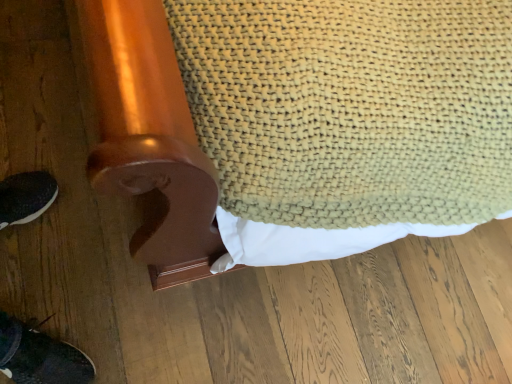
What do you see at coordinates (302, 122) in the screenshot?
I see `wooden bed frame at lower center` at bounding box center [302, 122].

Where is `wooden bed frame at lower center`? The image size is (512, 384). wooden bed frame at lower center is located at coordinates (302, 122).

I want to click on wooden bed frame at lower center, so click(x=302, y=122).